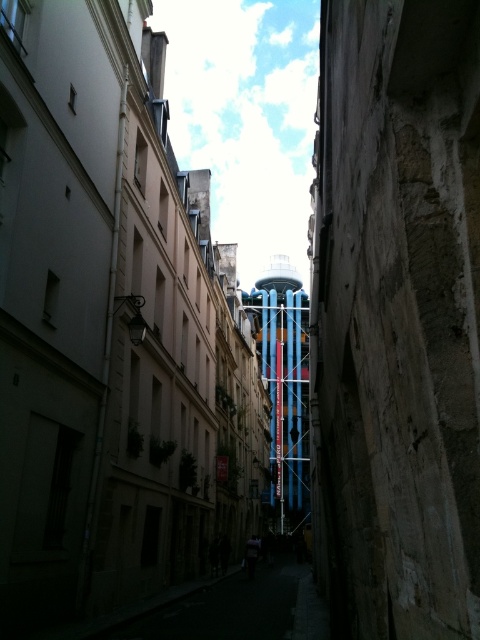
You are a delivery drone navigating through a narrow urban alleyway. You need to avoid obstacles and reach the delivery point at point (396, 317). According to the image, what is the exact location of the weathered stone wall at center?

The weathered stone wall at center is located at point (396, 317).

Consider the image. You are a painter who needs to set up an easel to paint the weathered stone wall at center and the blue metallic scaffolding at center. Given that your easel requires at least 2 meters of space in front of it to work comfortably, can you determine if there is enough space between the two objects to place your easel?

The weathered stone wall at center is smaller than the blue metallic scaffolding at center, but the distance between them isn not specified in the Objects Description. Therefore, it is impossible to determine if there is enough space for the easel based on the provided information.

You are standing at the entrance of the narrow urban alleyway and want to take a photo of the weathered stone wall at center. Where should you position yourself to capture it in the frame?

To capture the weathered stone wall at center in the frame, position yourself at the entrance of the narrow urban alleyway and aim your camera towards the center of the alleyway, where the weathered stone wall at center is located at point coordinates approximately at 0.498 on the x axis and 0.827 on the y axis.